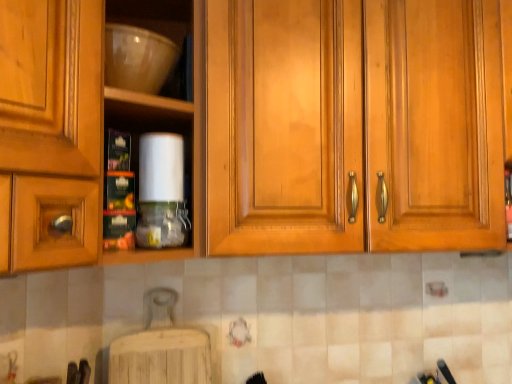
Question: Is matte wood cabinets at center with translucent plastic bottle at center?

Choices:
 (A) yes
 (B) no

Answer: (B)

Question: Could you tell me if matte wood cabinets at center is turned towards translucent plastic bottle at center?

Choices:
 (A) no
 (B) yes

Answer: (A)

Question: Considering the relative sizes of matte wood cabinets at center and translucent plastic bottle at center in the image provided, is matte wood cabinets at center smaller than translucent plastic bottle at center?

Choices:
 (A) yes
 (B) no

Answer: (B)

Question: Considering the relative positions of matte wood cabinets at center and translucent plastic bottle at center in the image provided, is matte wood cabinets at center in front of translucent plastic bottle at center?

Choices:
 (A) no
 (B) yes

Answer: (B)

Question: Is there a large distance between matte wood cabinets at center and translucent plastic bottle at center?

Choices:
 (A) yes
 (B) no

Answer: (B)

Question: Looking at the image, does matte white bowl at upper left seem bigger or smaller compared to translucent plastic bottle at center?

Choices:
 (A) big
 (B) small

Answer: (A)

Question: Is point (178, 28) closer or farther from the camera than point (141, 228)?

Choices:
 (A) closer
 (B) farther

Answer: (B)

Question: Is matte white bowl at upper left wider or thinner than translucent plastic bottle at center?

Choices:
 (A) thin
 (B) wide

Answer: (B)

Question: Considering the positions of matte white bowl at upper left and translucent plastic bottle at center in the image, is matte white bowl at upper left taller or shorter than translucent plastic bottle at center?

Choices:
 (A) short
 (B) tall

Answer: (B)

Question: In terms of width, does matte wood cabinets at center look wider or thinner when compared to translucent plastic bottle at center?

Choices:
 (A) thin
 (B) wide

Answer: (B)

Question: In terms of size, does matte wood cabinets at center appear bigger or smaller than translucent plastic bottle at center?

Choices:
 (A) big
 (B) small

Answer: (A)

Question: Considering the positions of matte wood cabinets at center and translucent plastic bottle at center in the image, is matte wood cabinets at center taller or shorter than translucent plastic bottle at center?

Choices:
 (A) tall
 (B) short

Answer: (A)

Question: From a real-world perspective, is matte wood cabinets at center above or below translucent plastic bottle at center?

Choices:
 (A) above
 (B) below

Answer: (A)

Question: Based on their positions, is matte wood cabinets at center located to the left or right of matte white bowl at upper left?

Choices:
 (A) left
 (B) right

Answer: (B)

Question: From the image's perspective, relative to matte white bowl at upper left, is matte wood cabinets at center above or below?

Choices:
 (A) below
 (B) above

Answer: (A)